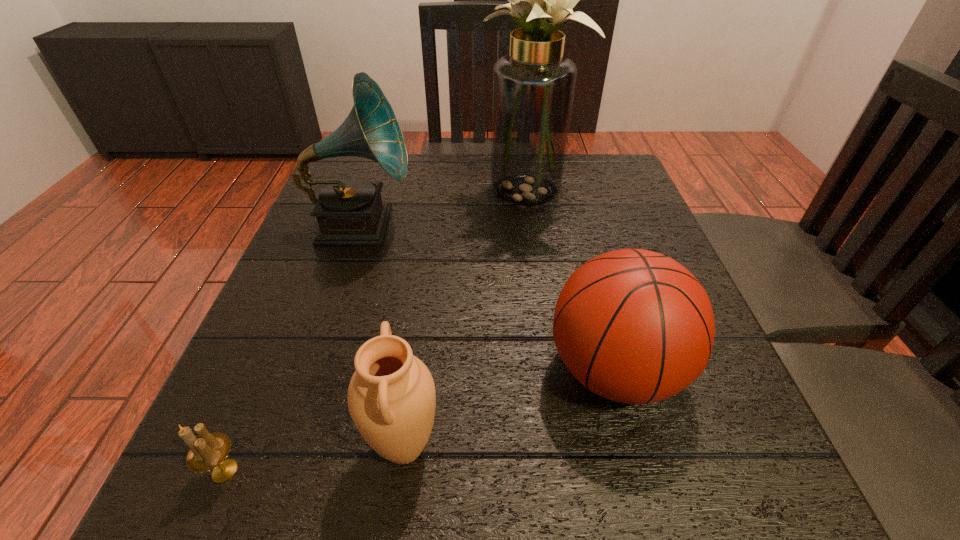
Where is `vacant space that is in between the tallest object and the fourth shortest object`? Image resolution: width=960 pixels, height=540 pixels. vacant space that is in between the tallest object and the fourth shortest object is located at coordinates (444, 208).

The height and width of the screenshot is (540, 960). Find the location of `free spot between the second tallest object and the candle holder`. free spot between the second tallest object and the candle holder is located at coordinates (293, 348).

Point out which object is positioned as the third nearest to the fourth shortest object. Please provide its 2D coordinates. Your answer should be formatted as a tuple, i.e. [(x, y)], where the tuple contains the x and y coordinates of a point satisfying the conditions above.

[(391, 397)]

You are a GUI agent. You are given a task and a screenshot of the screen. Output one action in this format:
    pyautogui.click(x=<x>, y=<y>)
    Task: Click on the object that can be found as the second closest to the urn
    This screenshot has width=960, height=540.
    Given the screenshot: What is the action you would take?
    pyautogui.click(x=634, y=326)

This screenshot has height=540, width=960. In order to click on vacant area that satisfies the following two spatial constraints: 1. on the back side of the basketball; 2. on the left side of the candle holder in this screenshot , I will do `click(267, 370)`.

The image size is (960, 540). I want to click on free space that satisfies the following two spatial constraints: 1. on the back side of the urn; 2. on the left side of the candle holder, so click(235, 447).

This screenshot has height=540, width=960. What are the coordinates of `free point that satisfies the following two spatial constraints: 1. on the back side of the shortest object; 2. on the right side of the urn` in the screenshot? It's located at (235, 447).